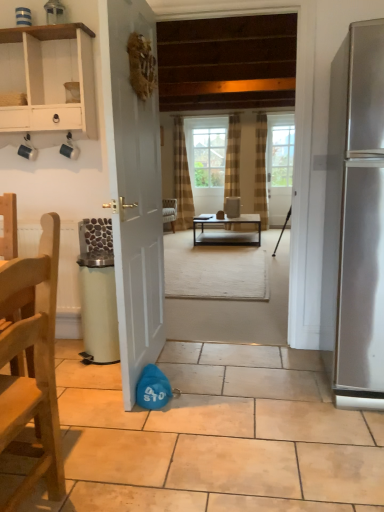
The height and width of the screenshot is (512, 384). What are the coordinates of `unoccupied area in front of white matte door at center, which ranks as the second door in back-to-front order` in the screenshot? It's located at coord(130,429).